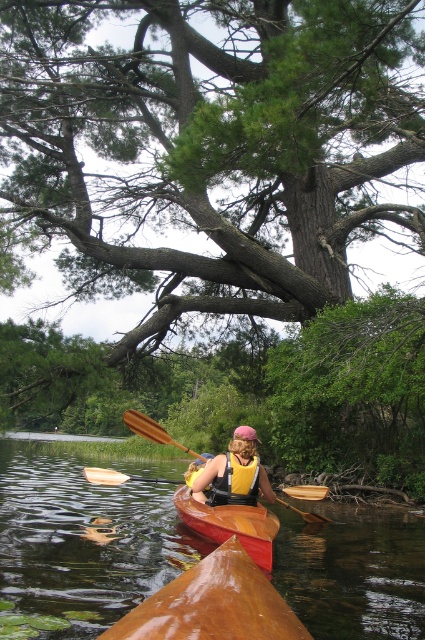
Question: Which point appears farthest from the camera in this image?

Choices:
 (A) (370, 620)
 (B) (79, 54)
 (C) (218, 513)
 (D) (158, 480)

Answer: (D)

Question: Estimate the real-world distances between objects in this image. Which object is farther from the wooden paddle at center?

Choices:
 (A) shiny brown canoe at center
 (B) yellow life vest at center

Answer: (A)

Question: Is green leafy tree at upper center further to camera compared to yellow life vest at center?

Choices:
 (A) yes
 (B) no

Answer: (A)

Question: Which object is closer to the camera taking this photo?

Choices:
 (A) glossy wood kayak at center
 (B) green leafy tree at upper center

Answer: (A)

Question: Does green leafy tree at upper center appear over shiny brown canoe at center?

Choices:
 (A) yes
 (B) no

Answer: (A)

Question: Is shiny brown canoe at center closer to the viewer compared to wooden canoe at center?

Choices:
 (A) no
 (B) yes

Answer: (B)